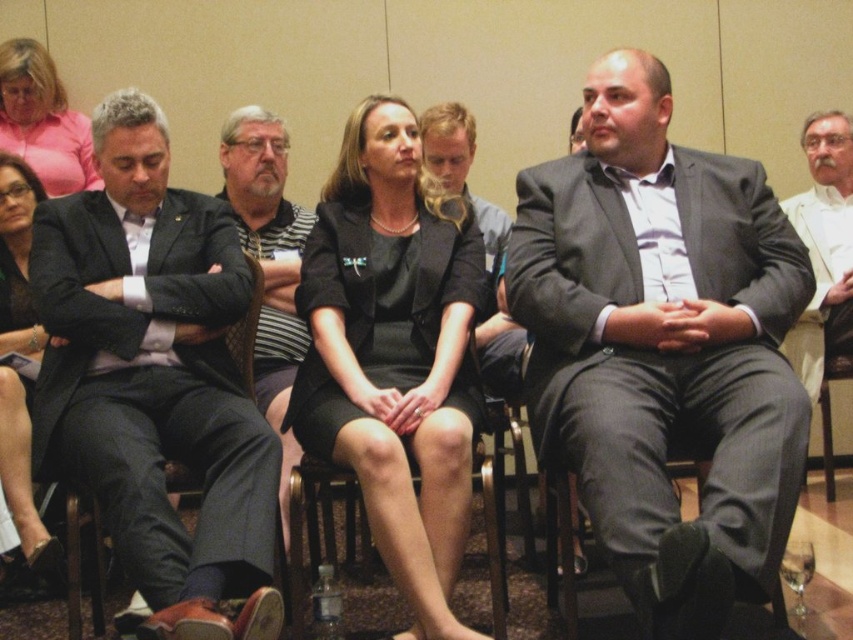
Between black satin dress at center and matte pink blouse at upper left, which one has more height?

black satin dress at center is taller.

This screenshot has width=853, height=640. What do you see at coordinates (393, 353) in the screenshot?
I see `black satin dress at center` at bounding box center [393, 353].

Find the location of a particular element. The image size is (853, 640). black satin dress at center is located at coordinates (393, 353).

Locate an element on the screen. The image size is (853, 640). black satin dress at center is located at coordinates (393, 353).

Between striped shirt at center and white textured suit at center, which one has more height?

striped shirt at center is taller.

Is point (262, 250) more distant than point (820, 298)?

No, it is not.

The height and width of the screenshot is (640, 853). What do you see at coordinates (268, 262) in the screenshot?
I see `striped shirt at center` at bounding box center [268, 262].

Locate an element on the screen. striped shirt at center is located at coordinates (268, 262).

Who is more distant from viewer, (231, 371) or (223, 156)?

Positioned behind is point (223, 156).

Is dark gray suit at left smaller than striped shirt at center?

No.

Does point (181, 323) lie in front of point (270, 196)?

That is True.

Where is `dark gray suit at left`? The image size is (853, 640). dark gray suit at left is located at coordinates (155, 378).